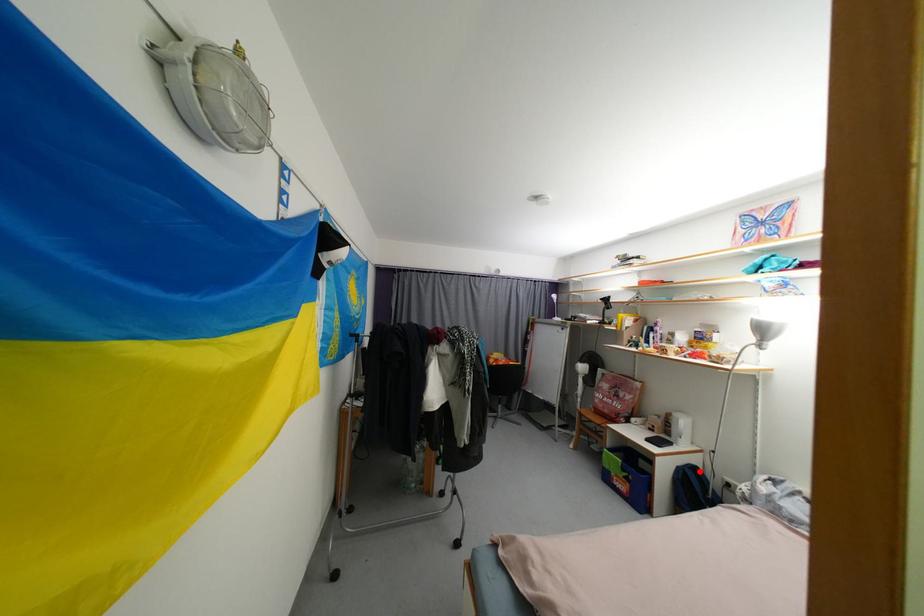
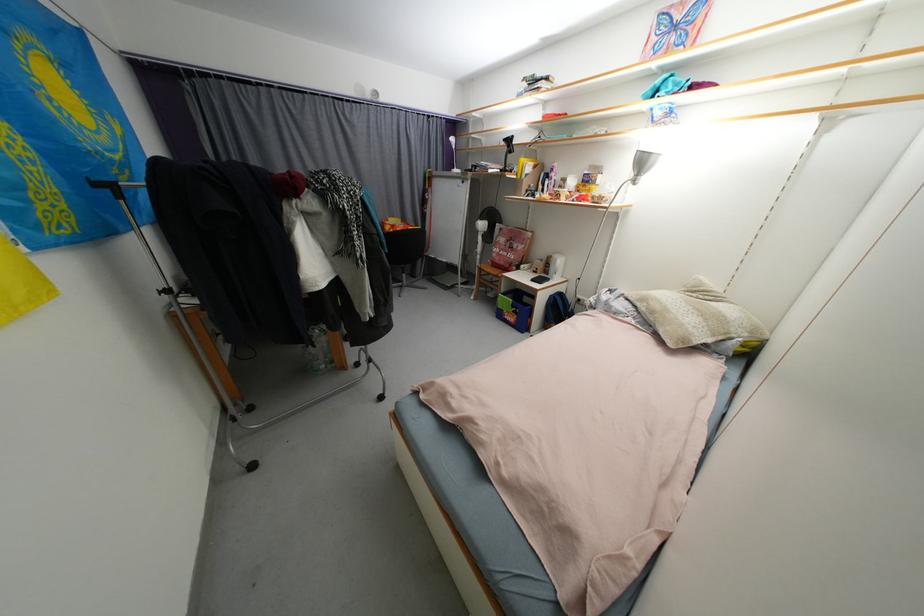
In the second image, find the point that corresponds to the highlighted location in the first image.

(565, 297)